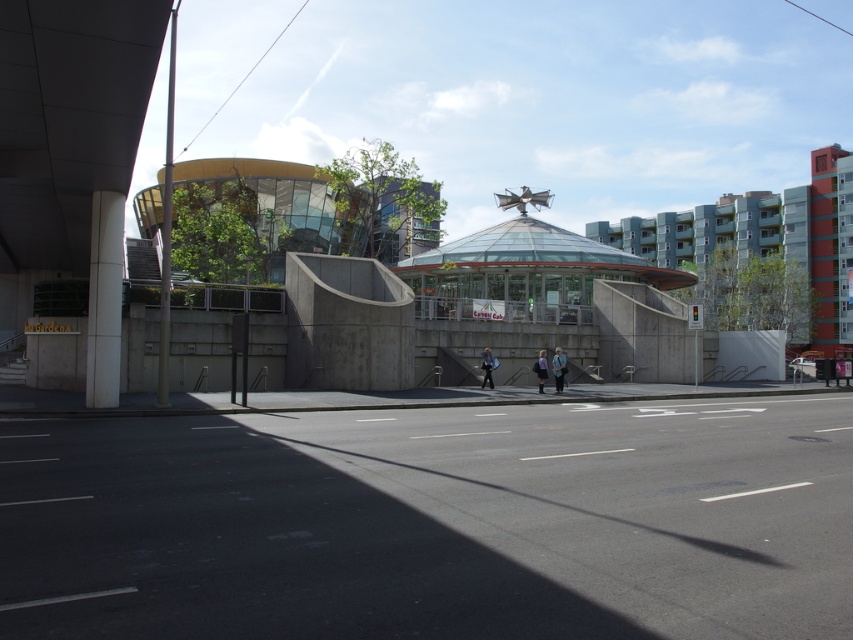
Looking at this image, you are a delivery person carrying a package that is 2 meters long. You need to walk through the space between the light blue denim jacket at center and the purple fabric bag at center. Can you pass through without tilting the package?

The distance between the light blue denim jacket at center and the purple fabric bag at center is 1.89 meters. Since the package is 2 meters long, it is longer than the available space. Therefore, you cannot pass through without tilting the package.

You are a delivery person holding a package and standing in front of the light blue denim jacket at center and the purple fabric bag at center. You need to place the package on the nearest object. Which object should you choose?

You should place the package on the light blue denim jacket at center because it is closer to you than the purple fabric bag at center.